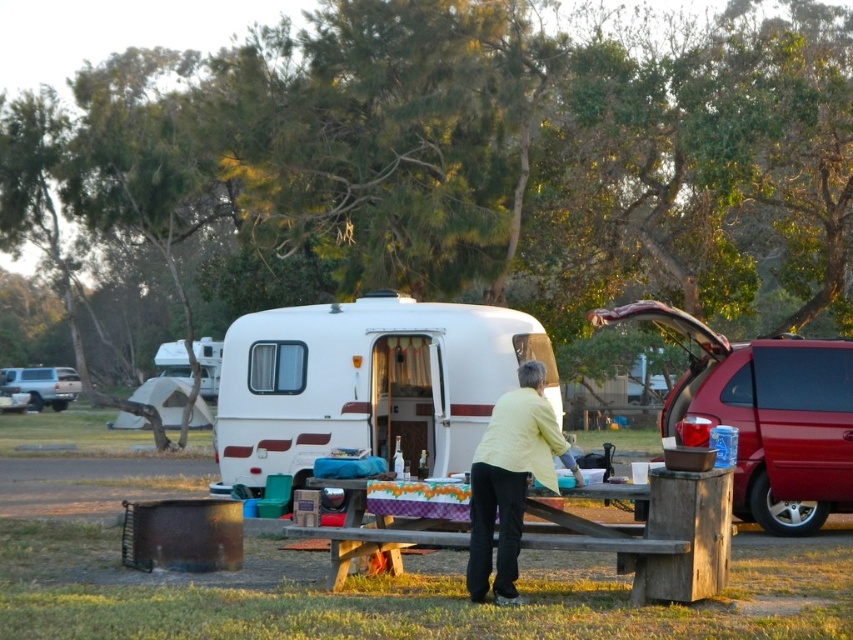
Does wooden picnic table at center appear over light yellow fabric at center?

No.

Is wooden picnic table at center to the left of light yellow fabric at center from the viewer's perspective?

Incorrect, wooden picnic table at center is not on the left side of light yellow fabric at center.

Between point (642, 602) and point (527, 410), which one is positioned in front?

Point (527, 410)

This screenshot has width=853, height=640. Find the location of `wooden picnic table at center`. wooden picnic table at center is located at coordinates pos(633,545).

In the scene shown: Measure the distance from metallic red van at right to silver metallic suv at left.

They are 137.96 feet apart.

Between metallic red van at right and silver metallic suv at left, which one has more height?

metallic red van at right is taller.

Find the location of a particular element. The image size is (853, 640). metallic red van at right is located at coordinates (764, 417).

Locate an element on the screen. This screenshot has height=640, width=853. wooden picnic table at center is located at coordinates (633, 545).

Can you confirm if wooden picnic table at center is bigger than silver metallic suv at left?

Incorrect, wooden picnic table at center is not larger than silver metallic suv at left.

Between point (367, 536) and point (24, 385), which one is positioned in front?

Point (367, 536) is more forward.

At what (x,y) coordinates should I click in order to perform the action: click on wooden picnic table at center. Please return your answer as a coordinate pair (x, y). Looking at the image, I should click on point(633,545).